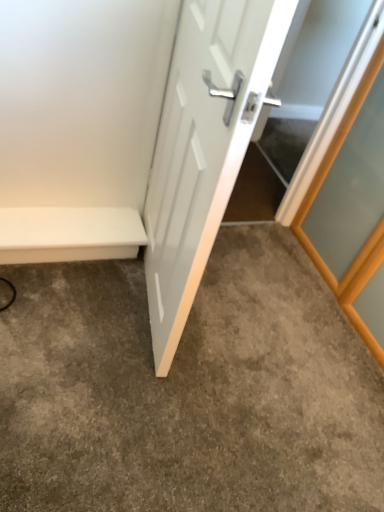
Question: In terms of height, does white glossy door at center look taller or shorter compared to white matte bench at lower left?

Choices:
 (A) tall
 (B) short

Answer: (A)

Question: Choose the correct answer: Is white glossy door at center inside white matte bench at lower left or outside it?

Choices:
 (A) outside
 (B) inside

Answer: (A)

Question: Which is farther from the gray carpet at center?

Choices:
 (A) white glossy door at center
 (B) white matte bench at lower left

Answer: (A)

Question: Which object is the closest to the white glossy door at center?

Choices:
 (A) white matte bench at lower left
 (B) gray carpet at center

Answer: (A)